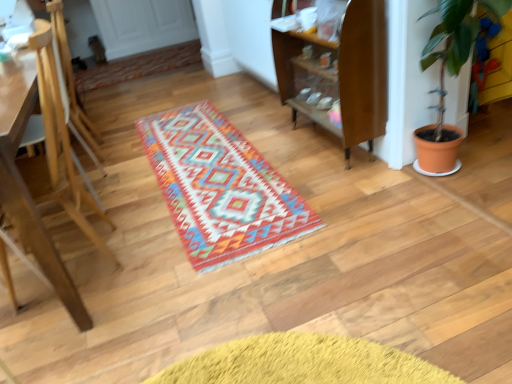
Question: Considering the positions of terracotta pot at right and multicolored woven rug at upper center in the image, is terracotta pot at right wider or thinner than multicolored woven rug at upper center?

Choices:
 (A) wide
 (B) thin

Answer: (B)

Question: Does point (468, 0) appear closer or farther from the camera than point (159, 67)?

Choices:
 (A) farther
 (B) closer

Answer: (B)

Question: Estimate the real-world distances between objects in this image. Which object is farther from the multicolored woven rug at center?

Choices:
 (A) wooden shelf at center
 (B) wooden armchair at left
 (C) terracotta pot at right
 (D) light brown wooden easel at left
 (E) multicolored woven rug at upper center

Answer: (E)

Question: Which object is positioned closest to the wooden shelf at center?

Choices:
 (A) terracotta pot at right
 (B) light brown wooden easel at left
 (C) multicolored woven rug at upper center
 (D) wooden armchair at left
 (E) multicolored woven rug at center

Answer: (A)